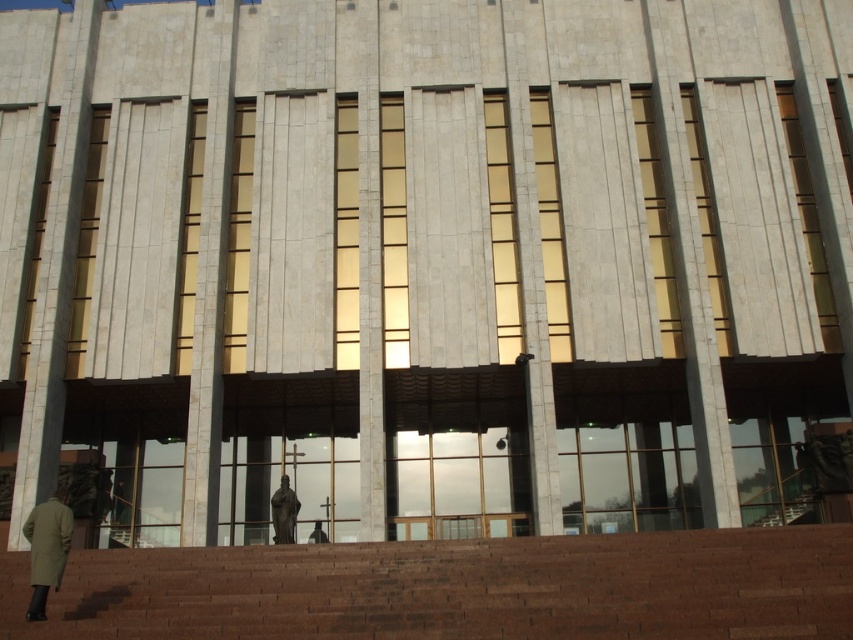
Question: Which point is farther to the camera?

Choices:
 (A) (288, 541)
 (B) (318, 524)
 (C) (64, 564)
 (D) (505, 547)

Answer: (B)

Question: Is dark olive-green fabric trench coat at lower left below dark gray fabric person at center?

Choices:
 (A) no
 (B) yes

Answer: (A)

Question: Can you confirm if brown brick stairs at lower left is smaller than dark gray fabric person at center?

Choices:
 (A) yes
 (B) no

Answer: (B)

Question: Which point appears closest to the camera in this image?

Choices:
 (A) (312, 529)
 (B) (288, 525)
 (C) (59, 564)
 (D) (715, 609)

Answer: (D)

Question: Can you confirm if brown brick stairs at lower left is smaller than bronze statue at center?

Choices:
 (A) yes
 (B) no

Answer: (B)

Question: Which object appears closest to the camera in this image?

Choices:
 (A) dark olive-green fabric trench coat at lower left
 (B) bronze statue at center
 (C) brown brick stairs at lower left

Answer: (C)